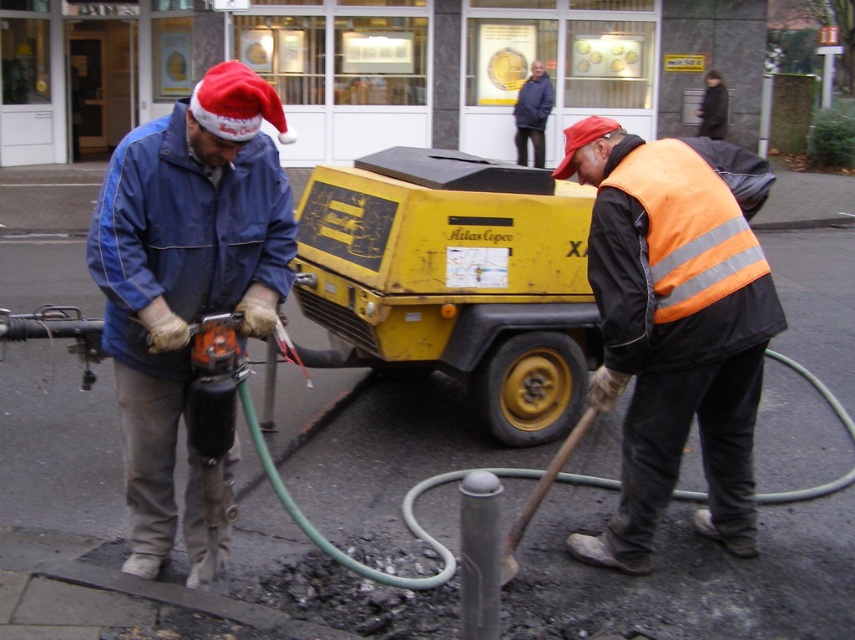
You are a safety inspector checking the visibility of workers. You notice the orange reflective vest at center and the blue denim jacket at left. Which worker is more visible from the road?

The orange reflective vest at center is more visible from the road because it is wider than the blue denim jacket at left.

You are a pedestrian observing the workers from the sidewalk. Which of the two items, the orange reflective vest at center or the blue denim jacket at left, appears closer to your eye level?

The orange reflective vest at center appears closer to your eye level because it is taller than the blue denim jacket at left.

You are a pedestrian trying to cross the street and notice two workers. You see the orange reflective vest at center and the blue denim jacket at upper center. Which worker is closer to the left side of the street?

The orange reflective vest at center is positioned on the left side of blue denim jacket at upper center, so the worker wearing the orange reflective vest at center is closer to the left side of the street.